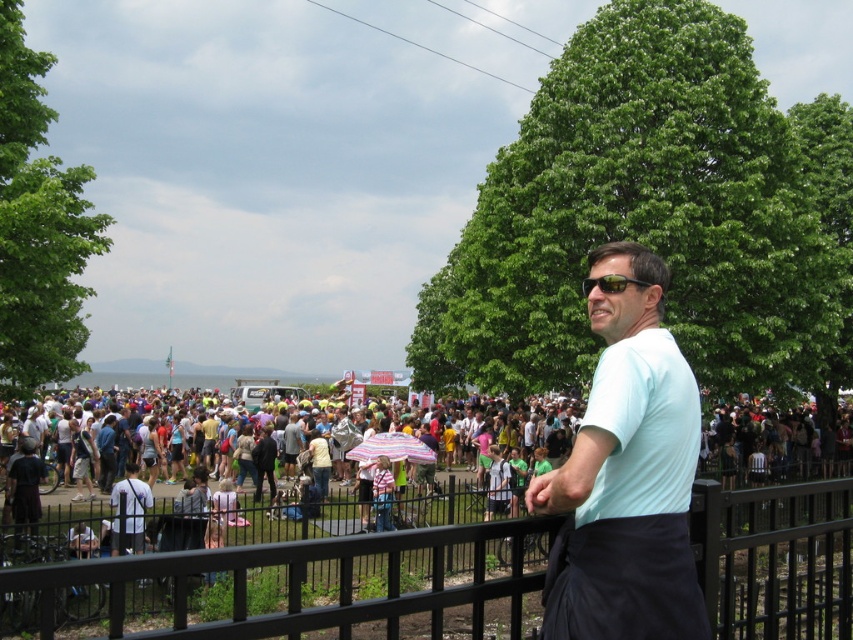
Is black metal fence at center below black reflective sunglasses at center?

Yes.

Is black metal fence at center positioned behind black reflective sunglasses at center?

No.

Between point (747, 637) and point (624, 282), which one is positioned in front?

Point (624, 282)

This screenshot has height=640, width=853. I want to click on black metal fence at center, so click(x=305, y=580).

Is light blue cotton polo shirt at center-right in front of striped fabric umbrella at center?

Yes, it is in front of striped fabric umbrella at center.

Does point (628, 408) come behind point (408, 440)?

No, (628, 408) is in front of (408, 440).

Locate an element on the screen. light blue cotton polo shirt at center-right is located at coordinates (642, 428).

Does striped fabric umbrella at center appear under black reflective sunglasses at center?

Correct, striped fabric umbrella at center is located below black reflective sunglasses at center.

Find the location of a particular element. The height and width of the screenshot is (640, 853). striped fabric umbrella at center is located at coordinates (392, 449).